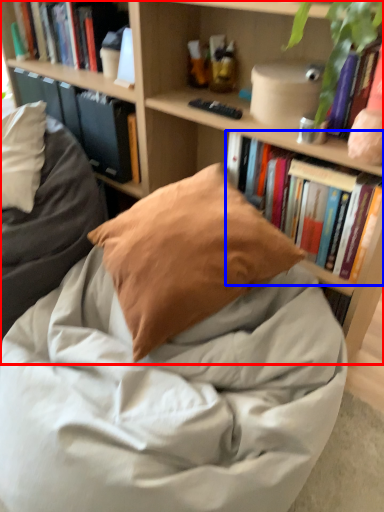
Question: Which point is further to the camera, bookcase (highlighted by a red box) or book (highlighted by a blue box)?

Choices:
 (A) bookcase
 (B) book

Answer: (B)